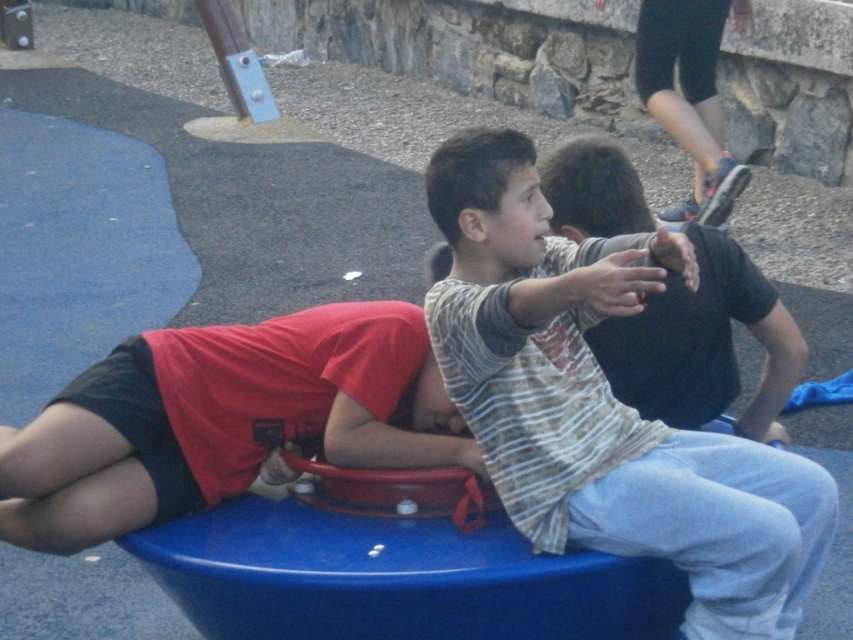
Question: Which of the following is the farthest from the observer?

Choices:
 (A) pyautogui.click(x=322, y=429)
 (B) pyautogui.click(x=738, y=492)

Answer: (A)

Question: Among these points, which one is nearest to the camera?

Choices:
 (A) (396, 380)
 (B) (456, 289)

Answer: (B)

Question: Does striped cotton shirt at center have a lesser width compared to matte red shirt at lower left?

Choices:
 (A) no
 (B) yes

Answer: (B)

Question: Can you confirm if striped cotton shirt at center is wider than matte red shirt at lower left?

Choices:
 (A) yes
 (B) no

Answer: (B)

Question: Which object is closer to the camera taking this photo?

Choices:
 (A) matte red shirt at lower left
 (B) striped cotton shirt at center

Answer: (B)

Question: Can you confirm if striped cotton shirt at center is positioned above matte red shirt at lower left?

Choices:
 (A) no
 (B) yes

Answer: (B)